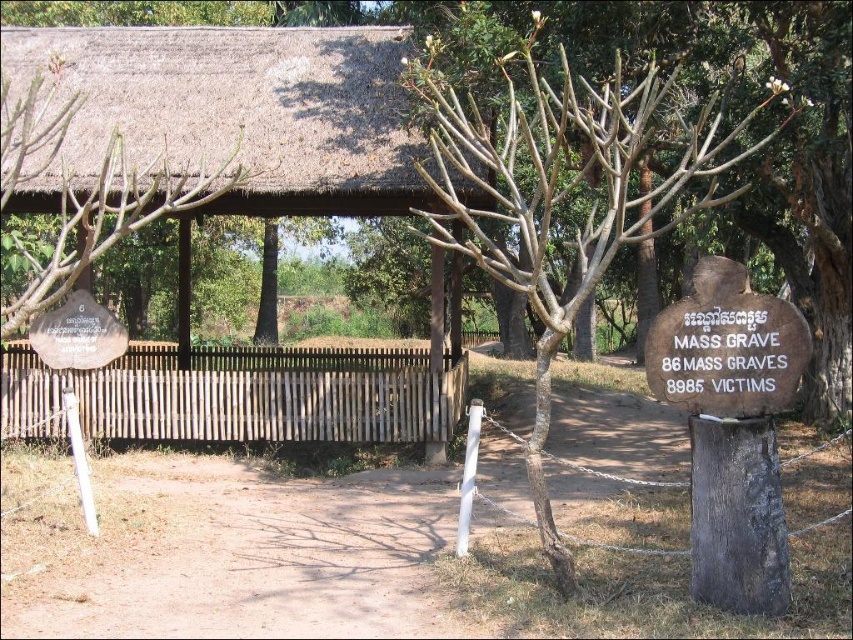
Question: Estimate the real-world distances between objects in this image. Which object is closer to the brown wooden fence at center?

Choices:
 (A) thatched roof hut at center
 (B) brown bark tree at center

Answer: (B)

Question: From the image, what is the correct spatial relationship of thatched roof hut at center in relation to brown bark tree at center?

Choices:
 (A) right
 (B) left

Answer: (B)

Question: Which is nearer to the thatched roof hut at center?

Choices:
 (A) brown wooden fence at center
 (B) brown bark tree at center

Answer: (A)

Question: Is the position of brown bark tree at center more distant than that of brown wooden fence at center?

Choices:
 (A) no
 (B) yes

Answer: (A)

Question: Does brown bark tree at center come behind brown wooden fence at center?

Choices:
 (A) yes
 (B) no

Answer: (B)

Question: Which point is closer to the camera taking this photo?

Choices:
 (A) (39, 189)
 (B) (242, 365)

Answer: (A)